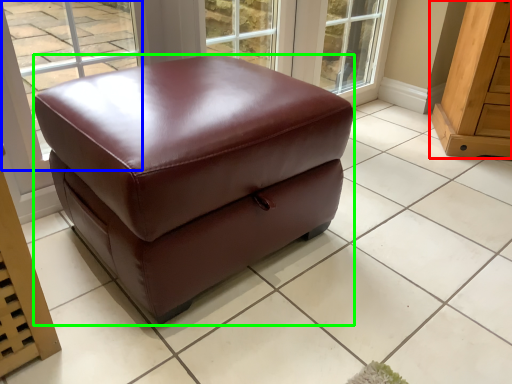
Question: Estimate the real-world distances between objects in this image. Which object is farther from furniture (highlighted by a red box), window (highlighted by a blue box) or furniture (highlighted by a green box)?

Choices:
 (A) window
 (B) furniture

Answer: (A)